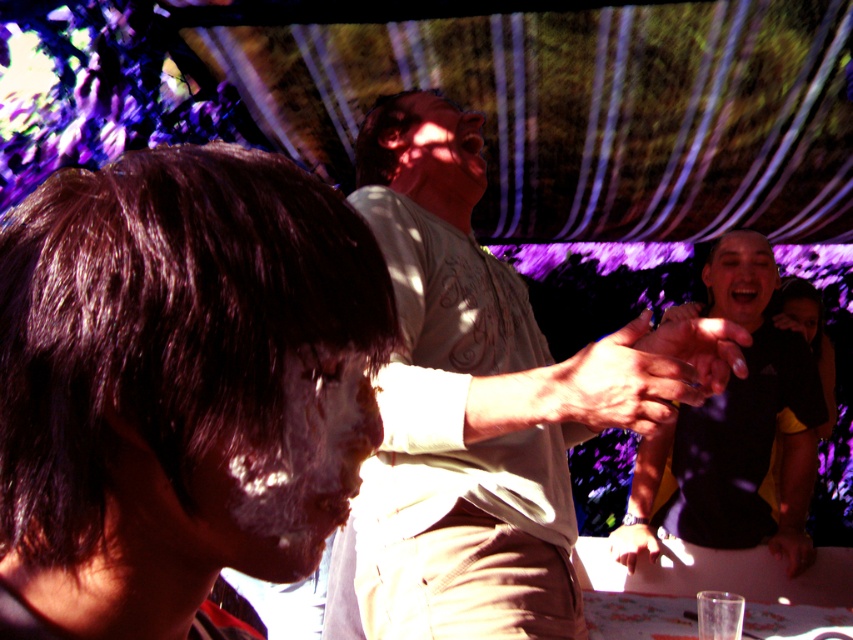
You are standing in the outdoor area under the tree canopy. You see a light beige shirt at center and a clear plastic ring at center. Which object is taller?

The light beige shirt at center is taller than the clear plastic ring at center.

You are at a picnic under the tree canopy and notice a light beige shirt at center and a clear plastic ring at center. Which object is positioned higher in the scene?

The light beige shirt at center is positioned higher than the clear plastic ring at center.

You are standing in the outdoor area under the tree canopy and see the black matte shirt at right and the clear plastic ring at center. Which object is closer to you?

The black matte shirt at right is closer to you because it is further to the viewer than the clear plastic ring at center.